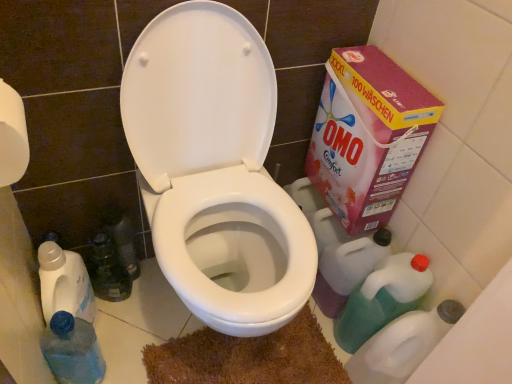
What do you see at coordinates (215, 168) in the screenshot? I see `white glossy toilet at center` at bounding box center [215, 168].

What is the approximate width of pink cardboard box at right?

pink cardboard box at right is 15.08 centimeters in width.

Describe the element at coordinates (367, 136) in the screenshot. I see `pink cardboard box at right` at that location.

I want to click on brown shaggy bath mat at center, so click(x=248, y=357).

Describe the element at coordinates (402, 345) in the screenshot. I see `translucent plastic bottle at lower right, placed as the 2th cleaning product when sorted from top to bottom` at that location.

Find the location of `white glossy toilet at center`. white glossy toilet at center is located at coordinates (215, 168).

Is translucent plastic bottle at lower left oriented away from brown shaggy bath mat at center?

translucent plastic bottle at lower left does not have its back to brown shaggy bath mat at center.

Is translucent plastic bottle at lower left next to brown shaggy bath mat at center?

No, translucent plastic bottle at lower left is not in contact with brown shaggy bath mat at center.

What's the angular difference between translucent plastic bottle at lower left and brown shaggy bath mat at center's facing directions?

The angular difference between translucent plastic bottle at lower left and brown shaggy bath mat at center is 0.655 degrees.

Considering the sizes of objects translucent plastic bottle at lower left and brown shaggy bath mat at center in the image provided, who is thinner, translucent plastic bottle at lower left or brown shaggy bath mat at center?

translucent plastic bottle at lower left.

From the picture: Is green translucent bottle at lower right, the second cleaning product ordered from the bottom, wider or thinner than translucent plastic bottle at lower left?

In the image, green translucent bottle at lower right, the second cleaning product ordered from the bottom, appears to be wider than translucent plastic bottle at lower left.

From the translucent plastic bottle at lower left, count 2nd cleaning products backward and point to it. Please provide its 2D coordinates.

[(382, 299)]

From the image's perspective, which is above, green translucent bottle at lower right, arranged as the first cleaning product when viewed from the top, or translucent plastic bottle at lower left?

From the image's view, green translucent bottle at lower right, arranged as the first cleaning product when viewed from the top, is above.

Is point (403, 288) farther from viewer compared to point (65, 319)?

That is True.

In terms of height, does brown shaggy bath mat at center look taller or shorter compared to translucent plastic bottle at lower left?

Clearly, brown shaggy bath mat at center is shorter compared to translucent plastic bottle at lower left.

Could you tell me if brown shaggy bath mat at center is turned towards translucent plastic bottle at lower left?

No, brown shaggy bath mat at center does not turn towards translucent plastic bottle at lower left.

How distant is brown shaggy bath mat at center from translucent plastic bottle at lower left?

brown shaggy bath mat at center is 34.44 centimeters from translucent plastic bottle at lower left.

Can you confirm if brown shaggy bath mat at center is wider than translucent plastic bottle at lower left?

Yes.

Does brown shaggy bath mat at center have a lesser height compared to green translucent bottle at lower right, the second cleaning product ordered from the bottom?

Yes.

Is green translucent bottle at lower right, arranged as the first cleaning product when viewed from the top, completely or partially inside brown shaggy bath mat at center?

Actually, green translucent bottle at lower right, arranged as the first cleaning product when viewed from the top, is outside brown shaggy bath mat at center.

Is brown shaggy bath mat at center bigger than green translucent bottle at lower right, the second cleaning product ordered from the bottom?

Incorrect, brown shaggy bath mat at center is not larger than green translucent bottle at lower right, the second cleaning product ordered from the bottom.

In terms of size, does white glossy toilet at center appear bigger or smaller than translucent plastic bottle at lower left?

Clearly, white glossy toilet at center is larger in size than translucent plastic bottle at lower left.

Is white glossy toilet at center inside or outside of translucent plastic bottle at lower left?

white glossy toilet at center is located beyond the bounds of translucent plastic bottle at lower left.

Between white glossy toilet at center and translucent plastic bottle at lower left, which one appears on the left side from the viewer's perspective?

translucent plastic bottle at lower left.

How far apart are white glossy toilet at center and translucent plastic bottle at lower left?

white glossy toilet at center is 18.12 inches from translucent plastic bottle at lower left.

Is pink cardboard box at right at the right side of brown shaggy bath mat at center?

Correct, you'll find pink cardboard box at right to the right of brown shaggy bath mat at center.

Between pink cardboard box at right and brown shaggy bath mat at center, which one has less height?

brown shaggy bath mat at center is shorter.

How much distance is there between pink cardboard box at right and brown shaggy bath mat at center?

pink cardboard box at right and brown shaggy bath mat at center are 21.13 inches apart from each other.

From the picture: Is pink cardboard box at right aimed at white glossy toilet at center?

Yes, pink cardboard box at right is oriented towards white glossy toilet at center.

Are pink cardboard box at right and white glossy toilet at center located far from each other?

Actually, pink cardboard box at right and white glossy toilet at center are a little close together.

Looking at the image, does pink cardboard box at right seem bigger or smaller compared to white glossy toilet at center?

Considering their sizes, pink cardboard box at right takes up less space than white glossy toilet at center.

From the image's perspective, does pink cardboard box at right appear higher than white glossy toilet at center?

Indeed, from the image's perspective, pink cardboard box at right is shown above white glossy toilet at center.

I want to click on bottle above the brown shaggy bath mat at center (from a real-world perspective), so click(72, 350).

From the translucent plastic bottle at lower left, count 2nd cleaning products backward and point to it. Please provide its 2D coordinates.

[(382, 299)]

Based on their spatial positions, is translucent plastic bottle at lower right, marked as the first cleaning product in a bottom-to-top arrangement, or translucent plastic bottle at lower left closer to green translucent bottle at lower right, the second cleaning product ordered from the bottom?

→ Among the two, translucent plastic bottle at lower right, marked as the first cleaning product in a bottom-to-top arrangement, is located nearer to green translucent bottle at lower right, the second cleaning product ordered from the bottom.

Based on their spatial positions, is translucent plastic bottle at lower left or translucent plastic bottle at lower right, marked as the first cleaning product in a bottom-to-top arrangement, further from brown shaggy bath mat at center?

Among the two, translucent plastic bottle at lower left is located further to brown shaggy bath mat at center.

When comparing their distances from green translucent bottle at lower right, the second cleaning product ordered from the bottom, does brown shaggy bath mat at center or translucent plastic bottle at lower right, marked as the first cleaning product in a bottom-to-top arrangement, seem closer?

translucent plastic bottle at lower right, marked as the first cleaning product in a bottom-to-top arrangement, is closer to green translucent bottle at lower right, the second cleaning product ordered from the bottom.

Considering their positions, is translucent plastic bottle at lower right, placed as the 2th cleaning product when sorted from top to bottom, positioned closer to white glossy toilet at center than brown shaggy bath mat at center?

Among the two, brown shaggy bath mat at center is located nearer to white glossy toilet at center.

Which object lies nearer to the anchor point green translucent bottle at lower right, arranged as the first cleaning product when viewed from the top, translucent plastic bottle at lower left or pink cardboard box at right?

pink cardboard box at right is closer to green translucent bottle at lower right, arranged as the first cleaning product when viewed from the top.

Based on their spatial positions, is brown shaggy bath mat at center or pink cardboard box at right further from white glossy toilet at center?

The object further to white glossy toilet at center is brown shaggy bath mat at center.

Considering their positions, is white glossy toilet at center positioned further to translucent plastic bottle at lower left than translucent plastic bottle at lower right, placed as the 2th cleaning product when sorted from top to bottom?

translucent plastic bottle at lower right, placed as the 2th cleaning product when sorted from top to bottom, is further to translucent plastic bottle at lower left.

Which object lies further to the anchor point white glossy toilet at center, green translucent bottle at lower right, arranged as the first cleaning product when viewed from the top, or pink cardboard box at right?

Among the two, green translucent bottle at lower right, arranged as the first cleaning product when viewed from the top, is located further to white glossy toilet at center.

Where is `cleaning product between pink cardboard box at right and translucent plastic bottle at lower right, placed as the 2th cleaning product when sorted from top to bottom, in the up-down direction`? Image resolution: width=512 pixels, height=384 pixels. cleaning product between pink cardboard box at right and translucent plastic bottle at lower right, placed as the 2th cleaning product when sorted from top to bottom, in the up-down direction is located at coordinates (382, 299).

Find the location of a particular element. The width and height of the screenshot is (512, 384). bath mat situated between translucent plastic bottle at lower left and green translucent bottle at lower right, the second cleaning product ordered from the bottom, from left to right is located at coordinates (248, 357).

In order to click on toilet between translucent plastic bottle at lower left and translucent plastic bottle at lower right, placed as the 2th cleaning product when sorted from top to bottom in this screenshot , I will do `click(215, 168)`.

Where is `cleaning product between translucent plastic bottle at lower left and translucent plastic bottle at lower right, placed as the 2th cleaning product when sorted from top to bottom`? Image resolution: width=512 pixels, height=384 pixels. cleaning product between translucent plastic bottle at lower left and translucent plastic bottle at lower right, placed as the 2th cleaning product when sorted from top to bottom is located at coordinates (382, 299).